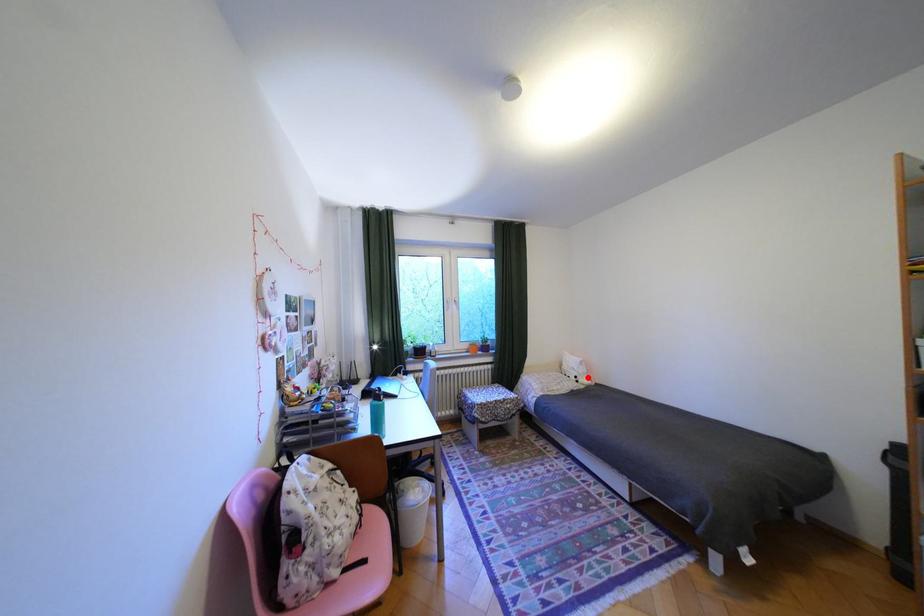
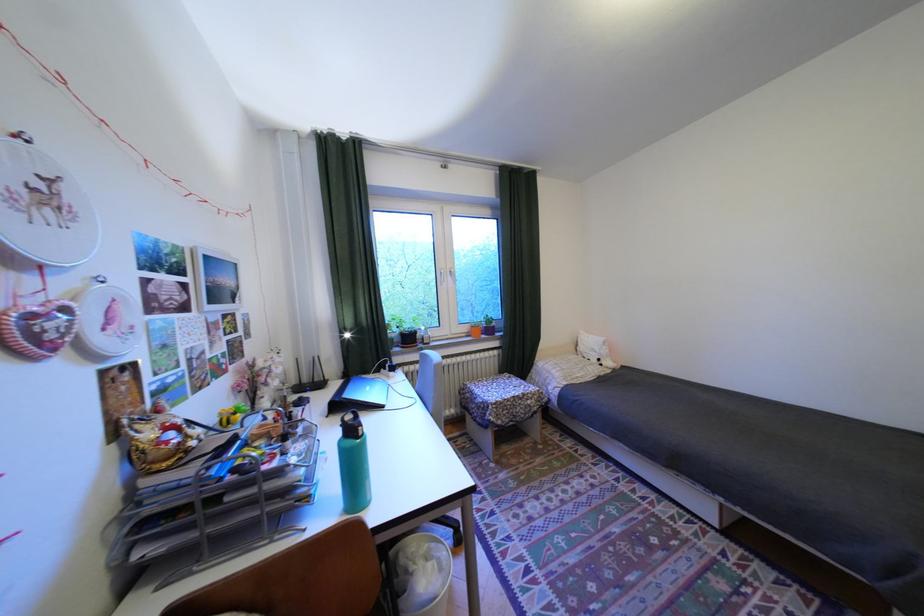
In the second image, find the point that corresponds to the highlighted location in the first image.

(611, 360)